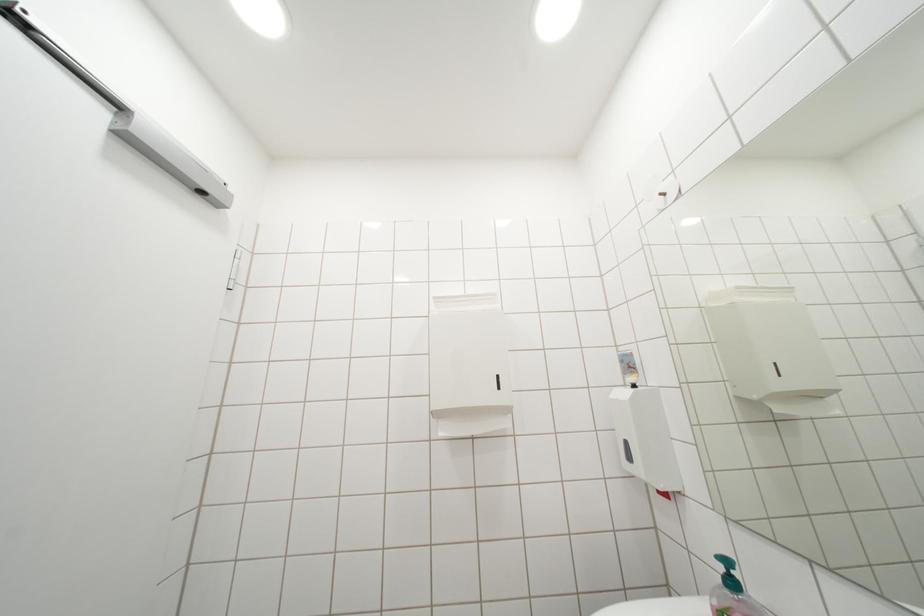
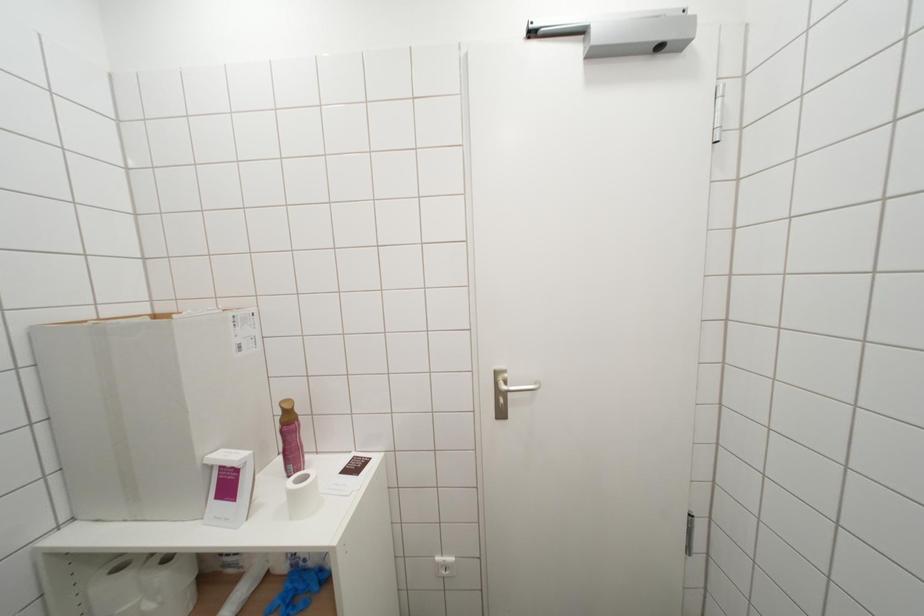
Question: The images are taken continuously from a first-person perspective. In which direction is your viewpoint rotating?

Choices:
 (A) Left
 (B) Right
 (C) Up
 (D) Down

Answer: (A)